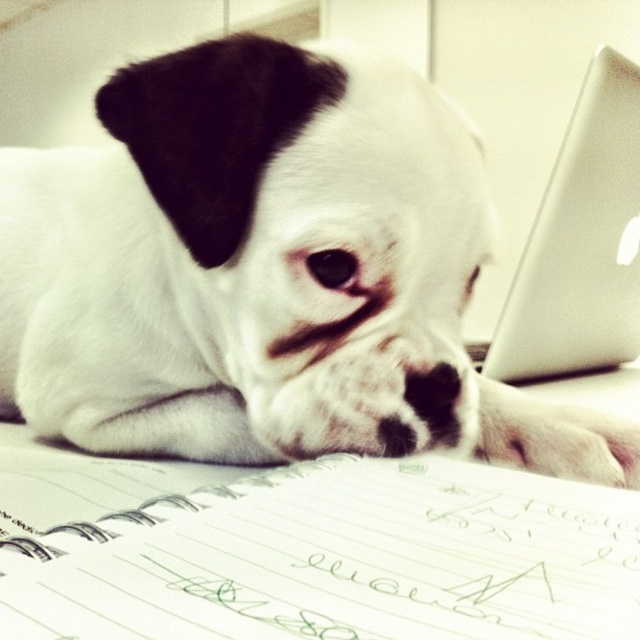
Is point (481, 177) behind point (616, 349)?

No, (481, 177) is in front of (616, 349).

This screenshot has height=640, width=640. What do you see at coordinates (266, 273) in the screenshot?
I see `white matte dog at center` at bounding box center [266, 273].

Where is `white matte dog at center`? Image resolution: width=640 pixels, height=640 pixels. white matte dog at center is located at coordinates (266, 273).